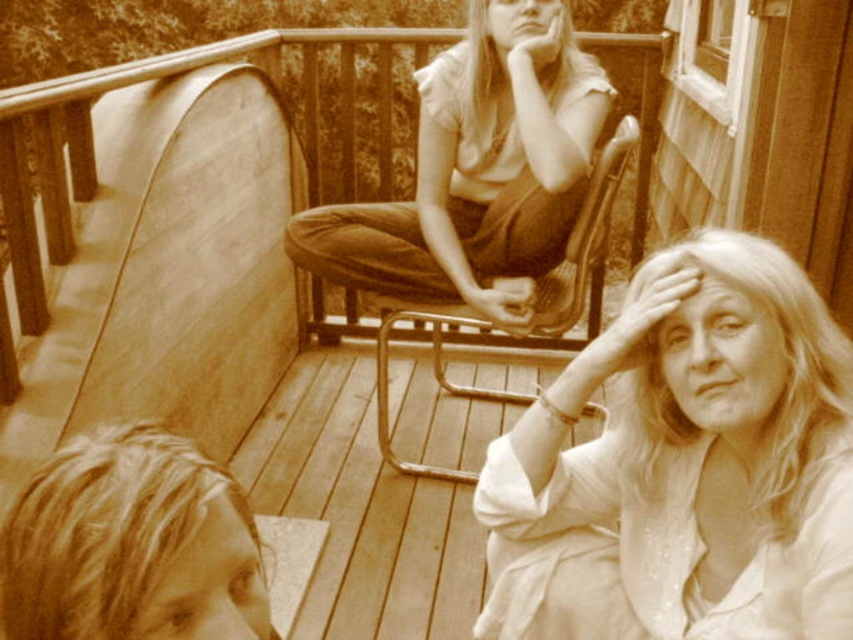
You are a photographer analyzing this vintage image. You notice two elements in the scene described as matte brown pants at center and blonde hair at lower left. Based on their relative sizes in the image, which one is closer to the camera?

The matte brown pants at center is larger in size than the blonde hair at lower left, so it is closer to the camera.

Looking at this image, based on the scene described, which object in the image is larger when comparing the smooth white blouse at lower right and the blonde hair at lower left?

The smooth white blouse at lower right is bigger than the blonde hair at lower left.